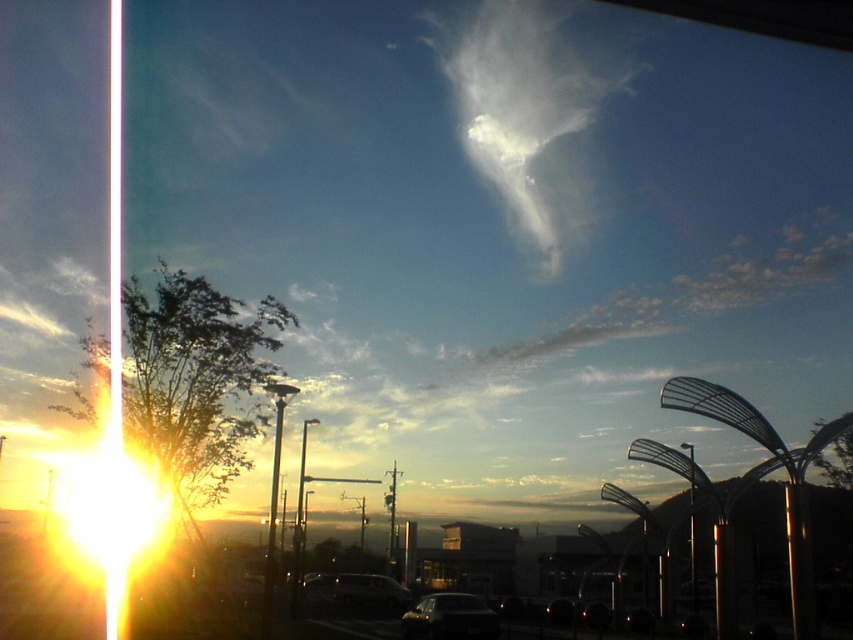
Question: Is dark gray metallic car at lower center positioned at the back of matte silver van at center?

Choices:
 (A) no
 (B) yes

Answer: (A)

Question: Considering the real-world distances, which object is farthest from the matte silver van at center?

Choices:
 (A) white fluffy cloud at upper center
 (B) dark gray metallic car at lower center

Answer: (A)

Question: Estimate the real-world distances between objects in this image. Which object is closer to the white fluffy cloud at upper center?

Choices:
 (A) dark gray metallic car at lower center
 (B) matte silver van at center

Answer: (B)

Question: Which of these objects is positioned farthest from the white fluffy cloud at upper center?

Choices:
 (A) matte silver van at center
 (B) dark gray metallic car at lower center

Answer: (B)

Question: Does dark gray metallic car at lower center come behind matte silver van at center?

Choices:
 (A) no
 (B) yes

Answer: (A)

Question: Does dark gray metallic car at lower center have a greater width compared to matte silver van at center?

Choices:
 (A) no
 (B) yes

Answer: (A)